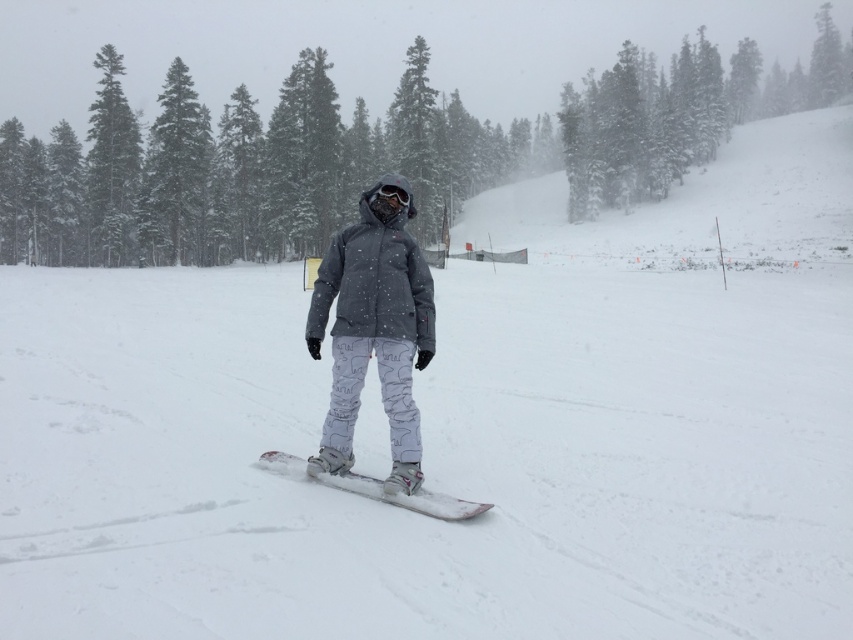
You are a snowboarder standing on your white matte snowboard at center. You want to reach the green matte tree at center. Given that the average speed of a snowboarder is 20 km per hour, how long would it take you to reach the tree?

The green matte tree at center is 152.32 meters from the white matte snowboard at center. To calculate the time, convert 20 km per hour to meters per second, which is approximately 5.56 m per second. Divide 152.32 meters by 5.56 m per second to get approximately 27.4 seconds. So, it would take roughly 27.4 seconds to reach the tree.

You are a snowboarder who just arrived at the snowy area. You see the white matte snowboard at center. Where is it located in terms of coordinates?

The white matte snowboard at center is located at point [376,488].

You are a photographer trying to capture the snowboarder in the scene. You notice the white matte snowboard at center and the matte black goggles at center. Which object is higher up in the image?

The white matte snowboard at center is much taller than the matte black goggles at center, so the white matte snowboard at center is higher up in the image.